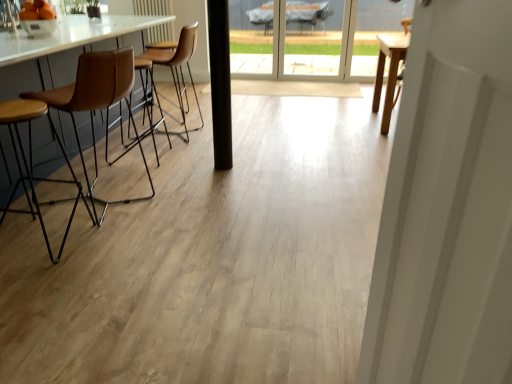
Question: Can you confirm if transparent glass screen door at upper center is taller than brown leather stool at left, placed as the second chair when sorted from back to front?

Choices:
 (A) no
 (B) yes

Answer: (B)

Question: Is transparent glass screen door at upper center positioned in front of brown leather stool at left, placed as the second chair when sorted from back to front?

Choices:
 (A) yes
 (B) no

Answer: (B)

Question: Does transparent glass screen door at upper center have a greater width compared to brown leather stool at left, placed as the second chair when sorted from back to front?

Choices:
 (A) no
 (B) yes

Answer: (A)

Question: Is the position of transparent glass screen door at upper center more distant than that of brown leather stool at left, positioned as the second chair in front-to-back order?

Choices:
 (A) yes
 (B) no

Answer: (A)

Question: From the image's perspective, would you say transparent glass screen door at upper center is shown under brown leather stool at left, positioned as the second chair in front-to-back order?

Choices:
 (A) no
 (B) yes

Answer: (A)

Question: Is transparent glass screen door at upper center taller or shorter than brown leather stool at left, positioned as the first chair in front-to-back order?

Choices:
 (A) tall
 (B) short

Answer: (A)

Question: From a real-world perspective, is transparent glass screen door at upper center physically located above or below brown leather stool at left, positioned as the first chair in front-to-back order?

Choices:
 (A) below
 (B) above

Answer: (B)

Question: Is transparent glass screen door at upper center to the left or to the right of brown leather stool at left, positioned as the first chair in front-to-back order, in the image?

Choices:
 (A) right
 (B) left

Answer: (A)

Question: From the image's perspective, is transparent glass screen door at upper center located above or below brown leather stool at left, positioned as the first chair in front-to-back order?

Choices:
 (A) below
 (B) above

Answer: (B)

Question: From the image's perspective, is brown leather chair at left, which is the 1th chair from back to front, above or below brown leather stool at left, placed as the second chair when sorted from back to front?

Choices:
 (A) below
 (B) above

Answer: (B)

Question: Considering the relative positions of brown leather chair at left, which is the 1th chair from back to front, and brown leather stool at left, placed as the second chair when sorted from back to front, in the image provided, is brown leather chair at left, which is the 1th chair from back to front, to the left or to the right of brown leather stool at left, placed as the second chair when sorted from back to front,?

Choices:
 (A) left
 (B) right

Answer: (B)

Question: Considering the positions of brown leather chair at left, marked as the 3th chair in a front-to-back arrangement, and brown leather stool at left, positioned as the second chair in front-to-back order, in the image, is brown leather chair at left, marked as the 3th chair in a front-to-back arrangement, wider or thinner than brown leather stool at left, positioned as the second chair in front-to-back order,?

Choices:
 (A) wide
 (B) thin

Answer: (A)

Question: Which is correct: brown leather chair at left, which is the 1th chair from back to front, is inside brown leather stool at left, positioned as the second chair in front-to-back order, or outside of it?

Choices:
 (A) outside
 (B) inside

Answer: (A)

Question: From the image's perspective, is brown leather stool at left, positioned as the second chair in front-to-back order, located above or below brown leather chair at left, marked as the 3th chair in a front-to-back arrangement?

Choices:
 (A) above
 (B) below

Answer: (B)

Question: Is brown leather stool at left, placed as the second chair when sorted from back to front, spatially inside brown leather chair at left, marked as the 3th chair in a front-to-back arrangement, or outside of it?

Choices:
 (A) outside
 (B) inside

Answer: (A)